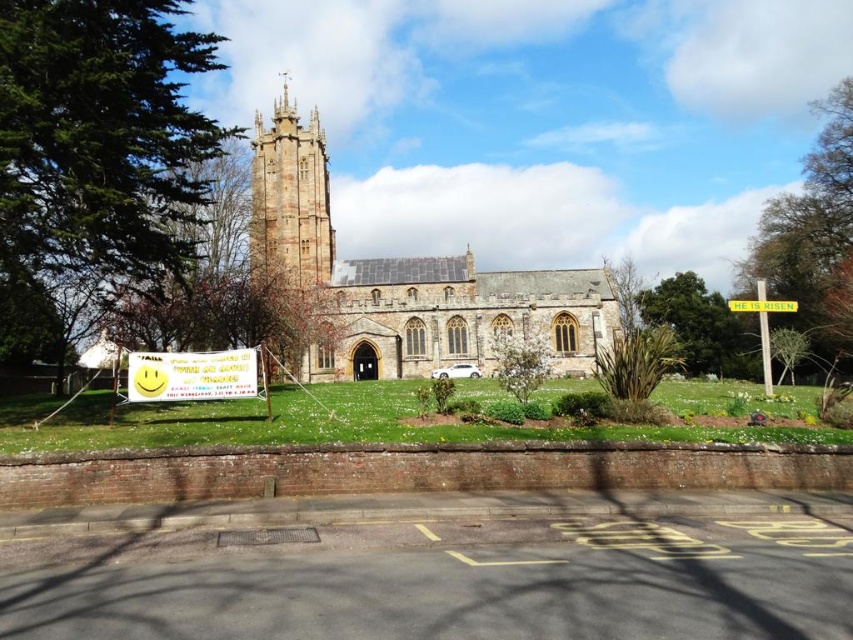
You are standing in front of the brown stone church at center and the yellow paper sign at center. Which object is higher in the image?

The brown stone church at center is higher than the yellow paper sign at center according to the description.

You are standing in front of the brown stone church at center and the yellow plastic sign at center. Which object is taller?

The brown stone church at center is taller than the yellow plastic sign at center.

You are standing in front of the brown stone church at center and want to hang a new banner higher than the yellow paper sign at center. Is the height of the church sufficient to allow this?

The brown stone church at center has a greater height compared to the yellow paper sign at center, so yes, the church is tall enough to allow hanging a banner higher than the yellow paper sign at center.